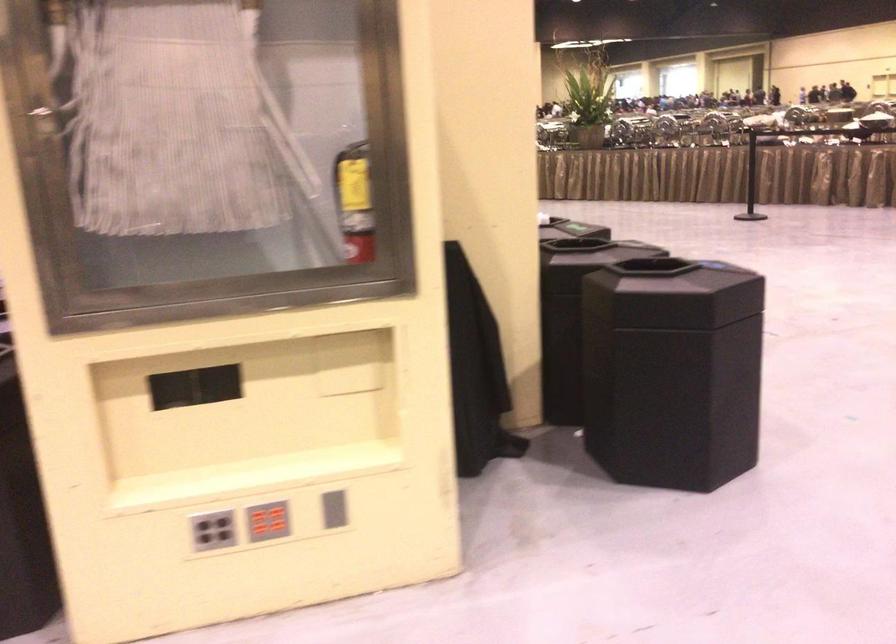
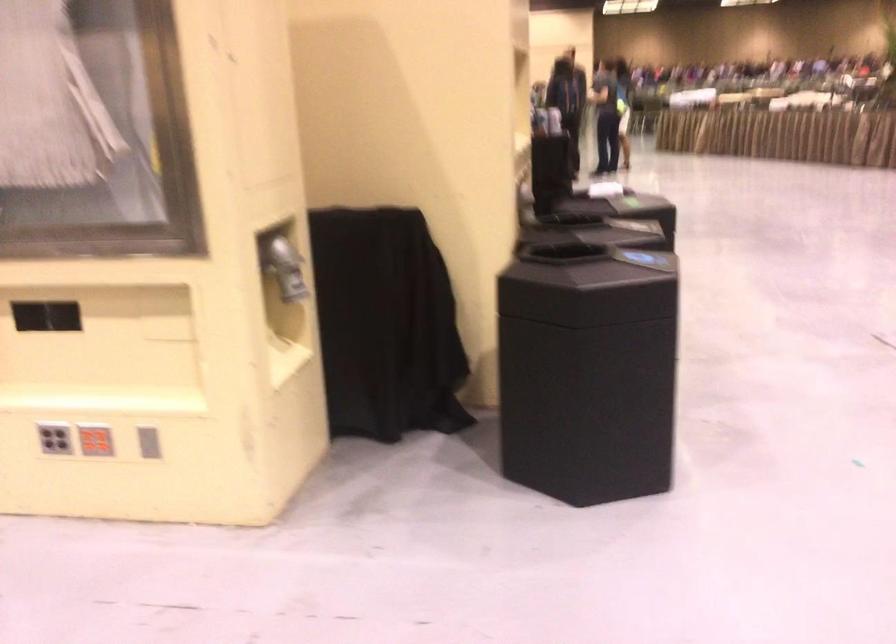
Question: What movement of the cameraman would produce the second image?

Choices:
 (A) Left
 (B) Right
 (C) Forward
 (D) Backward

Answer: (B)